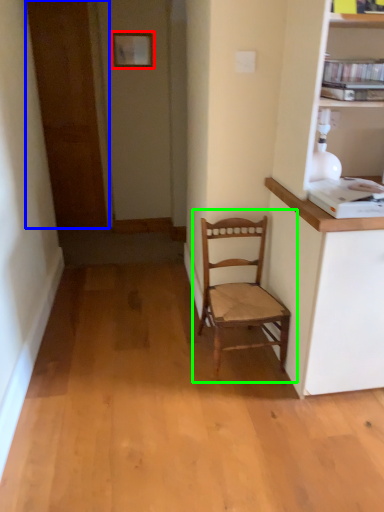
Question: Based on their relative distances, which object is nearer to picture frame (highlighted by a red box)? Choose from door (highlighted by a blue box) and chair (highlighted by a green box).

Choices:
 (A) door
 (B) chair

Answer: (A)